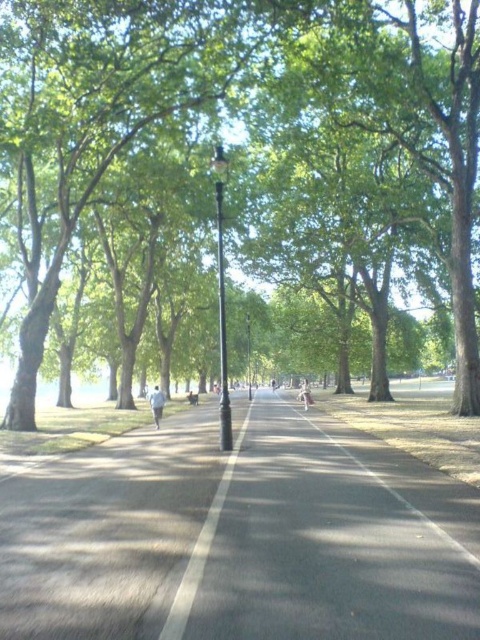
You are a pedestrian standing on the paved pathway in the park. You see a green leafy tree at center and a black polished metal lamp post at center. Which object is closer to the ground?

The green leafy tree at center is closer to the ground than the black polished metal lamp post at center.

You are a maintenance worker checking the pathway. You need to determine if the white smooth line at center is narrower than the black polished metal lamp post at center. Based on the scene, what can you conclude?

The white smooth line at center is thinner than the black polished metal lamp post at center, so yes, the white smooth line at center is narrower than the black polished metal lamp post at center.

You are a delivery person with a 1.5 meter tall box that needs to be placed on the black asphalt road at center or the black polished metal lamp post at center. Based on the scene, which object can the box be placed on?

The black asphalt road at center has a lesser height compared to black polished metal lamp post at center, so the box can be placed on the black asphalt road at center since it is flat and lower, while the lamp post is taller and likely not a suitable surface for placing items.